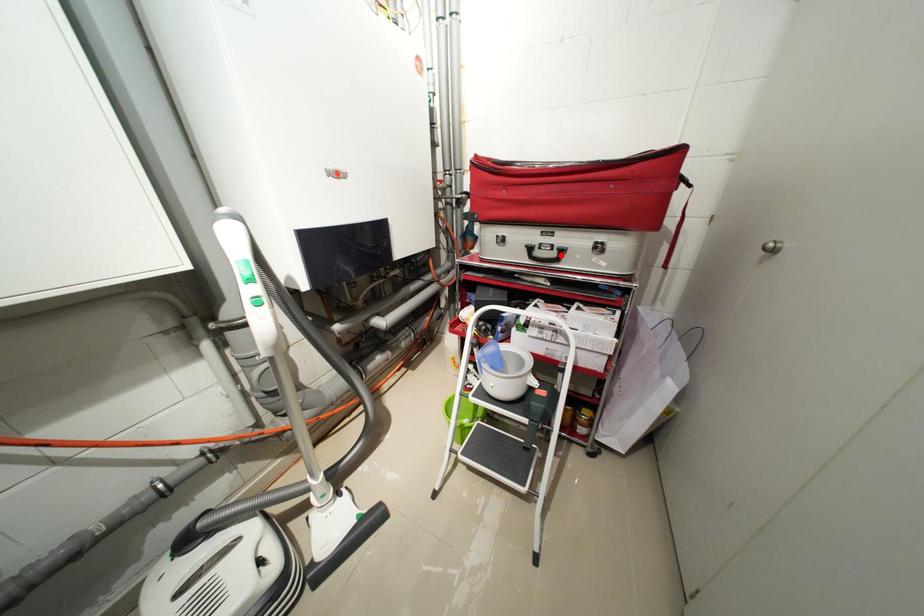
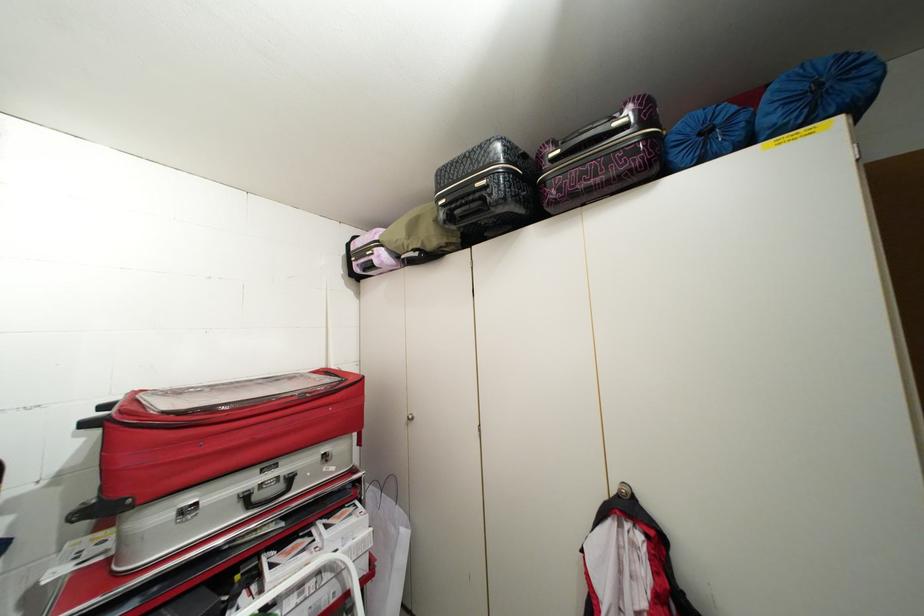
In the second image, find the point that corresponds to the highlighted location in the first image.

(287, 487)